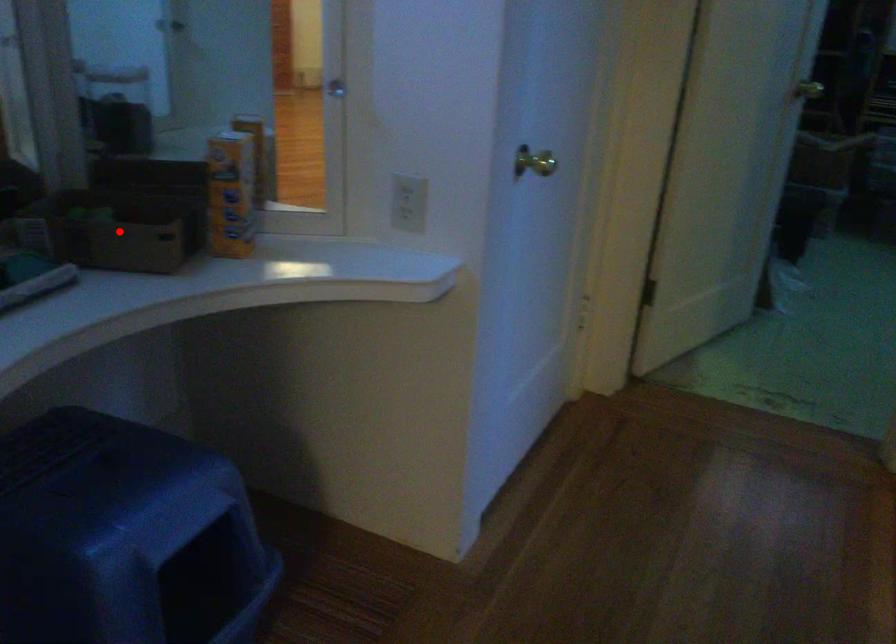
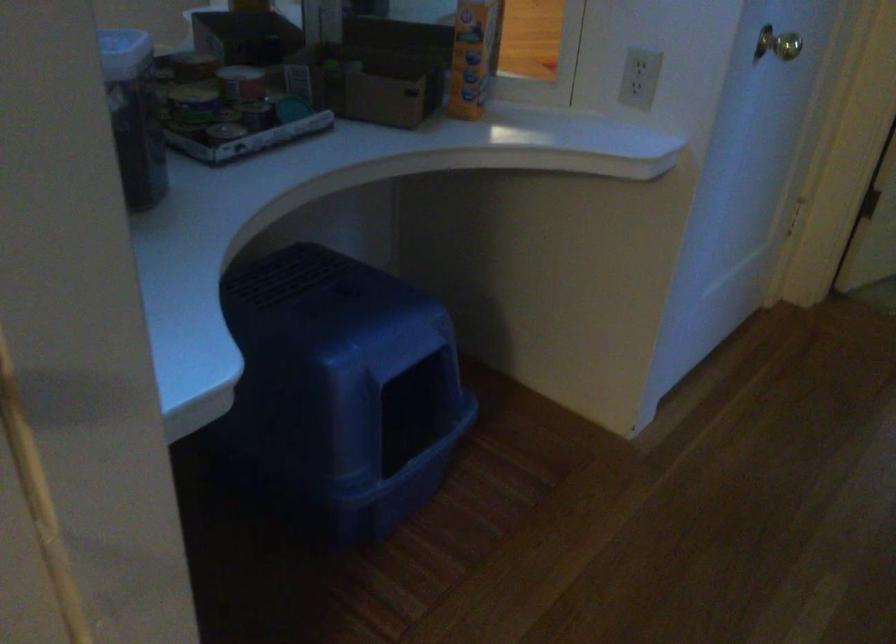
The point at the highlighted location is marked in the first image. Where is the corresponding point in the second image?

(369, 82)